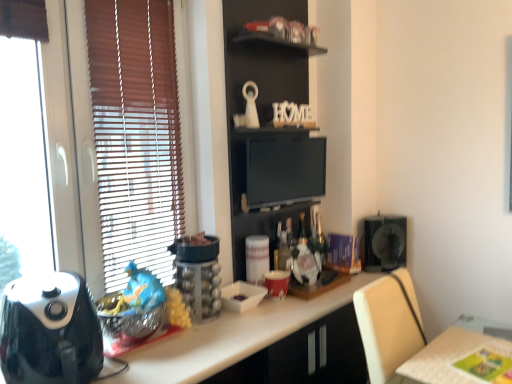
Identify the location of matte red cup at center, positioned as the fourth appliance in front-to-back order. [276, 283].

The image size is (512, 384). Describe the element at coordinates (276, 283) in the screenshot. I see `matte red cup at center, the 3th appliance viewed from the back` at that location.

Locate an element on the screen. white glossy countertop at center is located at coordinates (230, 338).

Locate an element on the screen. The width and height of the screenshot is (512, 384). matte black monitor at center is located at coordinates (284, 170).

The height and width of the screenshot is (384, 512). What do you see at coordinates (257, 258) in the screenshot? I see `white paper towel holder at center, marked as the third appliance in a right-to-left arrangement` at bounding box center [257, 258].

The image size is (512, 384). In order to click on black plastic fan at right, marked as the 1th appliance in a back-to-front arrangement in this screenshot , I will do `click(384, 243)`.

From a real-world perspective, is metallic silver blender at left, the second appliance from the front, below white glossy countertop at center?

No, from a real-world perspective, metallic silver blender at left, the second appliance from the front, is not under white glossy countertop at center.

From the image's perspective, is metallic silver blender at left, the second appliance from the left, above white glossy countertop at center?

Indeed, from the image's perspective, metallic silver blender at left, the second appliance from the left, is shown above white glossy countertop at center.

Who is smaller, metallic silver blender at left, the second appliance from the left, or white glossy countertop at center?

With smaller size is metallic silver blender at left, the second appliance from the left.

How different are the orientations of metallic silver blender at left, the second appliance from the left, and white glossy countertop at center in degrees?

The facing directions of metallic silver blender at left, the second appliance from the left, and white glossy countertop at center are 2.98 degrees apart.

In the image, is white paper towel holder at center, marked as the third appliance in a right-to-left arrangement, positioned in front of or behind white glossy countertop at center?

Visually, white paper towel holder at center, marked as the third appliance in a right-to-left arrangement, is located behind white glossy countertop at center.

From the image's perspective, is white paper towel holder at center, which is the 4th appliance in left-to-right order, located above white glossy countertop at center?

Correct, white paper towel holder at center, which is the 4th appliance in left-to-right order, appears higher than white glossy countertop at center in the image.

Is white paper towel holder at center, positioned as the 5th appliance in front-to-back order, positioned far away from white glossy countertop at center?

No.

From a real-world perspective, does white paper towel holder at center, which is the 4th appliance in left-to-right order, sit lower than white glossy countertop at center?

No.

From the image's perspective, is black glossy air fryer at left, which is the 6th appliance in right-to-left order, under matte black monitor at center?

Indeed, from the image's perspective, black glossy air fryer at left, which is the 6th appliance in right-to-left order, is shown beneath matte black monitor at center.

Is black glossy air fryer at left, which ranks as the sixth appliance in back-to-front order, positioned behind matte black monitor at center?

No, black glossy air fryer at left, which ranks as the sixth appliance in back-to-front order, is closer to the camera.

In the scene shown: Is black glossy air fryer at left, which ranks as the sixth appliance in back-to-front order, thinner than matte black monitor at center?

Incorrect, the width of black glossy air fryer at left, which ranks as the sixth appliance in back-to-front order, is not less than that of matte black monitor at center.

Where is `computer monitor behind the black glossy air fryer at left, which is the 6th appliance in right-to-left order`? The image size is (512, 384). computer monitor behind the black glossy air fryer at left, which is the 6th appliance in right-to-left order is located at coordinates coord(284,170).

Are white paper towel holder at center, positioned as the 5th appliance in front-to-back order, and black glossy air fryer at left, which is the 6th appliance in right-to-left order, located far from each other?

No, there isn't a large distance between white paper towel holder at center, positioned as the 5th appliance in front-to-back order, and black glossy air fryer at left, which is the 6th appliance in right-to-left order.

From the image's perspective, is white paper towel holder at center, positioned as the 5th appliance in front-to-back order, below black glossy air fryer at left, which is the first appliance from front to back?

No, from the image's perspective, white paper towel holder at center, positioned as the 5th appliance in front-to-back order, is not beneath black glossy air fryer at left, which is the first appliance from front to back.

Is white paper towel holder at center, positioned as the 5th appliance in front-to-back order, positioned with its back to black glossy air fryer at left, which is the first appliance from front to back?

No, black glossy air fryer at left, which is the first appliance from front to back, is not at the back of white paper towel holder at center, positioned as the 5th appliance in front-to-back order.

The width and height of the screenshot is (512, 384). Identify the location of the 3rd appliance counting from the left side of the white paper towel holder at center, marked as the third appliance in a right-to-left arrangement. (50, 331).

Considering the sizes of objects white glossy bowl at center, which is the third appliance from left to right, and white paper towel holder at center, which is the 4th appliance in left-to-right order, in the image provided, who is thinner, white glossy bowl at center, which is the third appliance from left to right, or white paper towel holder at center, which is the 4th appliance in left-to-right order,?

white paper towel holder at center, which is the 4th appliance in left-to-right order.

Is white glossy bowl at center, the third appliance from the front, facing towards white paper towel holder at center, the 2th appliance in the back-to-front sequence?

No, white glossy bowl at center, the third appliance from the front, is not facing towards white paper towel holder at center, the 2th appliance in the back-to-front sequence.

Who is shorter, white glossy bowl at center, arranged as the 4th appliance when viewed from the right, or white paper towel holder at center, which is the 4th appliance in left-to-right order?

white glossy bowl at center, arranged as the 4th appliance when viewed from the right, is shorter.

Is white paper towel holder at center, positioned as the 5th appliance in front-to-back order, bigger or smaller than matte red cup at center, positioned as the fourth appliance in front-to-back order?

In the image, white paper towel holder at center, positioned as the 5th appliance in front-to-back order, appears to be larger than matte red cup at center, positioned as the fourth appliance in front-to-back order.

From the image's perspective, is white paper towel holder at center, marked as the third appliance in a right-to-left arrangement, below matte red cup at center, positioned as the fourth appliance in front-to-back order?

No, from the image's perspective, white paper towel holder at center, marked as the third appliance in a right-to-left arrangement, is not below matte red cup at center, positioned as the fourth appliance in front-to-back order.

From a real-world perspective, count 4th appliances upward from the matte red cup at center, the fifth appliance from the left, and point to it. Please provide its 2D coordinates.

[(257, 258)]

Is white paper towel holder at center, marked as the third appliance in a right-to-left arrangement, situated inside matte red cup at center, the fifth appliance from the left, or outside?

white paper towel holder at center, marked as the third appliance in a right-to-left arrangement, is not enclosed by matte red cup at center, the fifth appliance from the left.

Can you tell me how much white glossy countertop at center and metallic silver blender at left, the 5th appliance positioned from the right, differ in facing direction?

The angular difference between white glossy countertop at center and metallic silver blender at left, the 5th appliance positioned from the right, is 2.98 degrees.

Which object is closer to the camera, white glossy countertop at center or metallic silver blender at left, the second appliance from the left?

white glossy countertop at center is more forward.

Considering the points (181, 377) and (217, 243), which point is in front, point (181, 377) or point (217, 243)?

The point (181, 377) is closer.

Is white glossy countertop at center far from metallic silver blender at left, positioned as the fifth appliance in back-to-front order?

white glossy countertop at center is near metallic silver blender at left, positioned as the fifth appliance in back-to-front order, not far away.

Where is `the 3rd appliance above the white glossy countertop at center (from a real-world perspective)`? Image resolution: width=512 pixels, height=384 pixels. the 3rd appliance above the white glossy countertop at center (from a real-world perspective) is located at coordinates (198, 274).

At what (x,y) coordinates should I click in order to perform the action: click on countertop below the white paper towel holder at center, the 2th appliance in the back-to-front sequence (from the image's perspective). Please return your answer as a coordinate pair (x, y). Looking at the image, I should click on (230, 338).

Estimate the real-world distances between objects in this image. Which object is closer to matte red cup at center, the fifth appliance from the left, black glossy air fryer at left, which ranks as the sixth appliance in back-to-front order, or wooden bookshelf at upper center?

Among the two, wooden bookshelf at upper center is located nearer to matte red cup at center, the fifth appliance from the left.

Based on their spatial positions, is matte black monitor at center or white glossy bowl at center, the third appliance from the front, further from white glossy countertop at center?

The object further to white glossy countertop at center is matte black monitor at center.

Estimate the real-world distances between objects in this image. Which object is further from black plastic fan at right, marked as the 1th appliance in a back-to-front arrangement, wooden bookshelf at upper center or matte black monitor at center?

wooden bookshelf at upper center is further to black plastic fan at right, marked as the 1th appliance in a back-to-front arrangement.

Based on their spatial positions, is metallic silver blender at left, positioned as the fifth appliance in back-to-front order, or white glossy countertop at center further from light brown wooden table at lower right?

Among the two, metallic silver blender at left, positioned as the fifth appliance in back-to-front order, is located further to light brown wooden table at lower right.

Which object lies nearer to the anchor point matte red cup at center, the fifth appliance from the left, black plastic fan at right, placed as the sixth appliance when sorted from left to right, or light brown wooden table at lower right?

Among the two, black plastic fan at right, placed as the sixth appliance when sorted from left to right, is located nearer to matte red cup at center, the fifth appliance from the left.

Estimate the real-world distances between objects in this image. Which object is further from white paper towel holder at center, which is the 4th appliance in left-to-right order, wooden bookshelf at upper center or metallic silver blender at left, the second appliance from the left?

Among the two, wooden bookshelf at upper center is located further to white paper towel holder at center, which is the 4th appliance in left-to-right order.

In the scene shown: Estimate the real-world distances between objects in this image. Which object is closer to metallic silver blender at left, the 5th appliance positioned from the right, wooden bookshelf at upper center or black plastic fan at right, placed as the sixth appliance when sorted from left to right?

Based on the image, wooden bookshelf at upper center appears to be nearer to metallic silver blender at left, the 5th appliance positioned from the right.

When comparing their distances from white glossy countertop at center, does metallic silver blender at left, the second appliance from the front, or black glossy air fryer at left, which ranks as the sixth appliance in back-to-front order, seem closer?

metallic silver blender at left, the second appliance from the front, lies closer to white glossy countertop at center than the other object.

I want to click on computer monitor between metallic silver blender at left, the second appliance from the front, and black plastic fan at right, the sixth appliance when ordered from front to back, so click(284, 170).

This screenshot has width=512, height=384. I want to click on bookshelf located between metallic silver blender at left, the second appliance from the front, and light brown wooden table at lower right in the left-right direction, so click(269, 124).

Where is `appliance that lies between matte red cup at center, the 3th appliance viewed from the back, and white glossy countertop at center from top to bottom`? The width and height of the screenshot is (512, 384). appliance that lies between matte red cup at center, the 3th appliance viewed from the back, and white glossy countertop at center from top to bottom is located at coordinates (242, 296).

Where is `computer monitor situated between metallic silver blender at left, the second appliance from the left, and light brown wooden table at lower right from left to right`? The width and height of the screenshot is (512, 384). computer monitor situated between metallic silver blender at left, the second appliance from the left, and light brown wooden table at lower right from left to right is located at coordinates (284, 170).